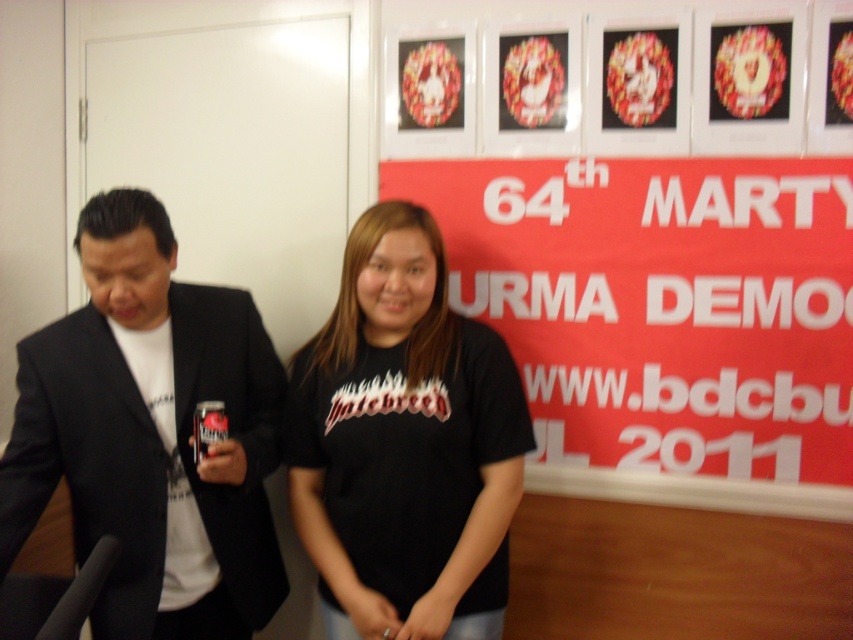
Question: Is red matte poster at center above black matte t-shirt at center?

Choices:
 (A) yes
 (B) no

Answer: (A)

Question: Which object is farther from the camera taking this photo?

Choices:
 (A) black matte suit at left
 (B) black matte t-shirt at center

Answer: (B)

Question: Which object is the farthest from the red matte poster at center?

Choices:
 (A) black matte suit at left
 (B) black matte t-shirt at center

Answer: (A)

Question: Is red matte poster at center closer to camera compared to black matte t-shirt at center?

Choices:
 (A) no
 (B) yes

Answer: (A)

Question: Based on their relative distances, which object is farther from the red matte poster at center?

Choices:
 (A) black matte t-shirt at center
 (B) black matte suit at left

Answer: (B)

Question: Does red matte poster at center have a smaller size compared to black matte suit at left?

Choices:
 (A) yes
 (B) no

Answer: (B)